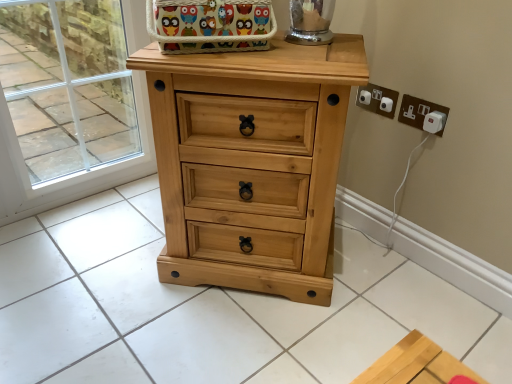
Where is `vacant area that is situated to the right of multicolored fabric basket at upper center`? Image resolution: width=512 pixels, height=384 pixels. vacant area that is situated to the right of multicolored fabric basket at upper center is located at coordinates (309, 54).